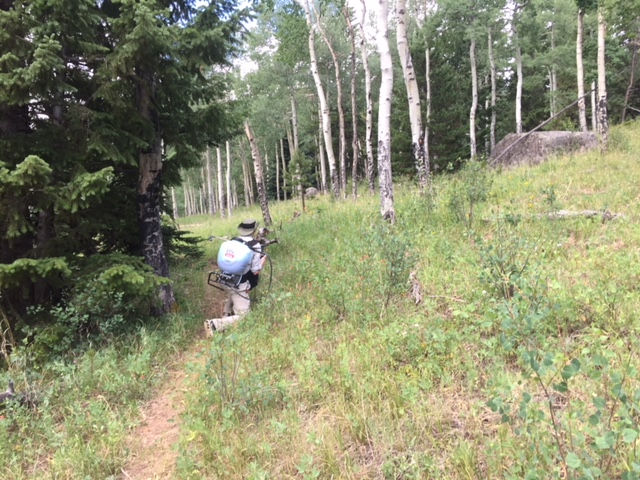
Locate an element on the screen. The image size is (640, 480). bucket is located at coordinates (246, 224).